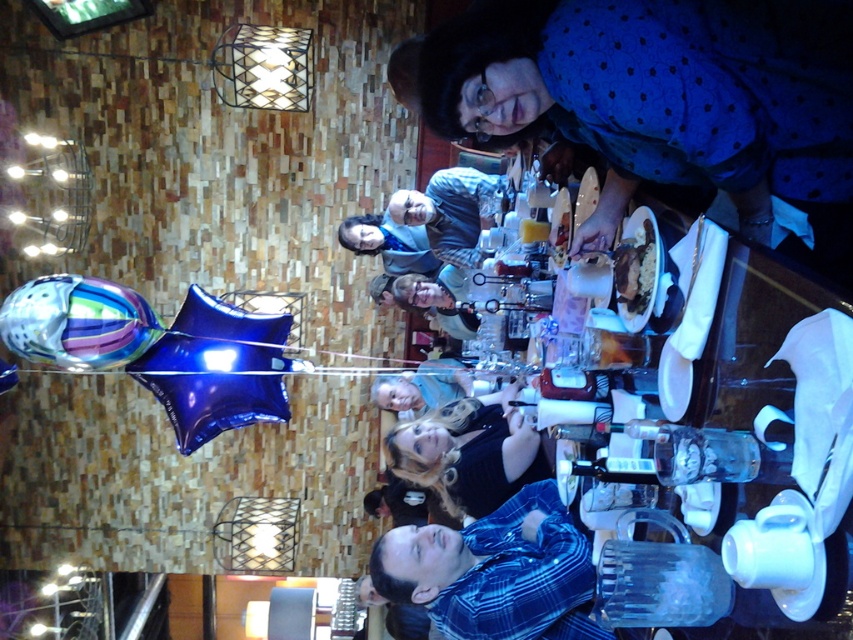
Question: Which object appears closest to the camera in this image?

Choices:
 (A) metallic blue star at center
 (B) multicolored glossy balloon at lower left

Answer: (B)

Question: Is metallic blue star at center below blue plaid shirt at center?

Choices:
 (A) no
 (B) yes

Answer: (B)

Question: Which point is closer to the camera?

Choices:
 (A) (468, 259)
 (B) (770, 22)

Answer: (B)

Question: Does blue dotted dress at upper right appear under matte gray sweater at center?

Choices:
 (A) no
 (B) yes

Answer: (B)

Question: Which object is closer to the camera taking this photo?

Choices:
 (A) shiny silver plate at center
 (B) multicolored glossy balloon at lower left
 (C) blue dotted dress at upper right
 (D) metallic blue star at center

Answer: (C)

Question: Observing the image, what is the correct spatial positioning of multicolored glossy balloon at lower left in reference to shiny silver plate at center?

Choices:
 (A) right
 (B) left

Answer: (B)